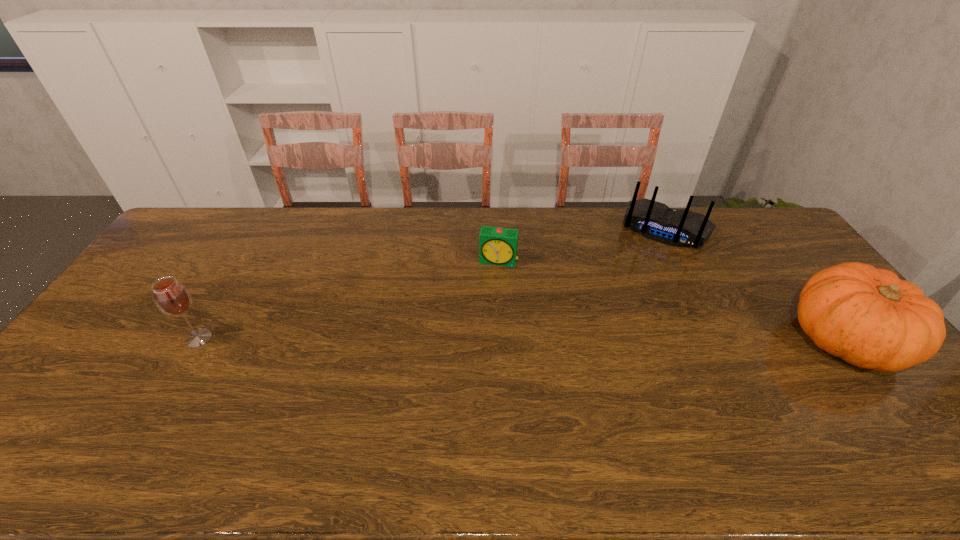
Locate an element on the screen. free space on the desktop that is between the wineglass and the rightmost object and is positioned on the back of the second object from right to left is located at coordinates (615, 339).

At what (x,y) coordinates should I click in order to perform the action: click on free spot on the desktop that is between the leftmost object and the pumpkin and is positioned on the front-facing side of the alarm clock. Please return your answer as a coordinate pair (x, y). Image resolution: width=960 pixels, height=540 pixels. Looking at the image, I should click on (481, 339).